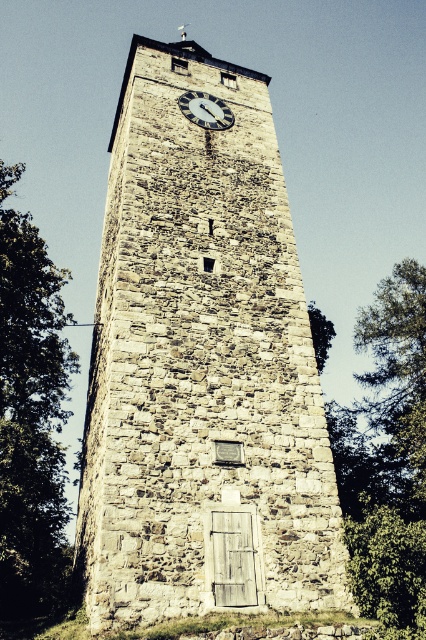
Is green leafy tree at right closer to camera compared to green leafy tree at left?

Yes, green leafy tree at right is closer to the viewer.

Does point (405, 268) lie behind point (2, 563)?

Yes.

Measure the distance between point (388,362) and camera.

68.99 meters

Where is `green leafy tree at right`? Image resolution: width=426 pixels, height=640 pixels. green leafy tree at right is located at coordinates (388, 458).

Who is more forward, (13,544) or (313,348)?

Positioned in front is point (313,348).

Is green leafy tree at left in front of green leafy tree at center?

No, green leafy tree at left is behind green leafy tree at center.

Is point (0, 492) positioned after point (316, 323)?

That is False.

In order to click on green leafy tree at left in this screenshot , I will do `click(31, 417)`.

Looking at this image, who is higher up, green leafy tree at left or white stone clock at upper center?

white stone clock at upper center is above.

Between green leafy tree at left and white stone clock at upper center, which one is positioned lower?

green leafy tree at left is lower down.

Between point (63, 509) and point (196, 97), which one is positioned behind?

Positioned behind is point (63, 509).

This screenshot has width=426, height=640. I want to click on green leafy tree at left, so click(31, 417).